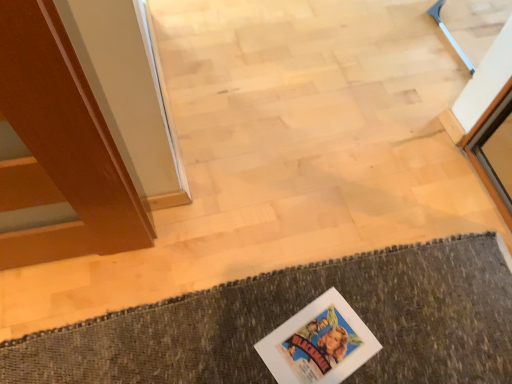
Question: From their relative heights in the image, would you say textured wool bath mat at lower center is taller or shorter than colorful paper comic book at lower center?

Choices:
 (A) tall
 (B) short

Answer: (A)

Question: Is textured wool bath mat at lower center bigger or smaller than colorful paper comic book at lower center?

Choices:
 (A) big
 (B) small

Answer: (A)

Question: From a real-world perspective, is textured wool bath mat at lower center physically located above or below colorful paper comic book at lower center?

Choices:
 (A) below
 (B) above

Answer: (A)

Question: Considering their positions, is colorful paper comic book at lower center located in front of or behind textured wool bath mat at lower center?

Choices:
 (A) behind
 (B) front

Answer: (A)

Question: From a real-world perspective, is colorful paper comic book at lower center positioned above or below textured wool bath mat at lower center?

Choices:
 (A) above
 (B) below

Answer: (A)

Question: From their relative heights in the image, would you say colorful paper comic book at lower center is taller or shorter than textured wool bath mat at lower center?

Choices:
 (A) short
 (B) tall

Answer: (A)

Question: From the image's perspective, is colorful paper comic book at lower center located above or below textured wool bath mat at lower center?

Choices:
 (A) above
 (B) below

Answer: (A)